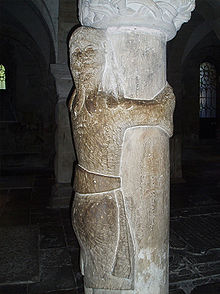
Find the location of `back left wall`. back left wall is located at coordinates (26, 111).